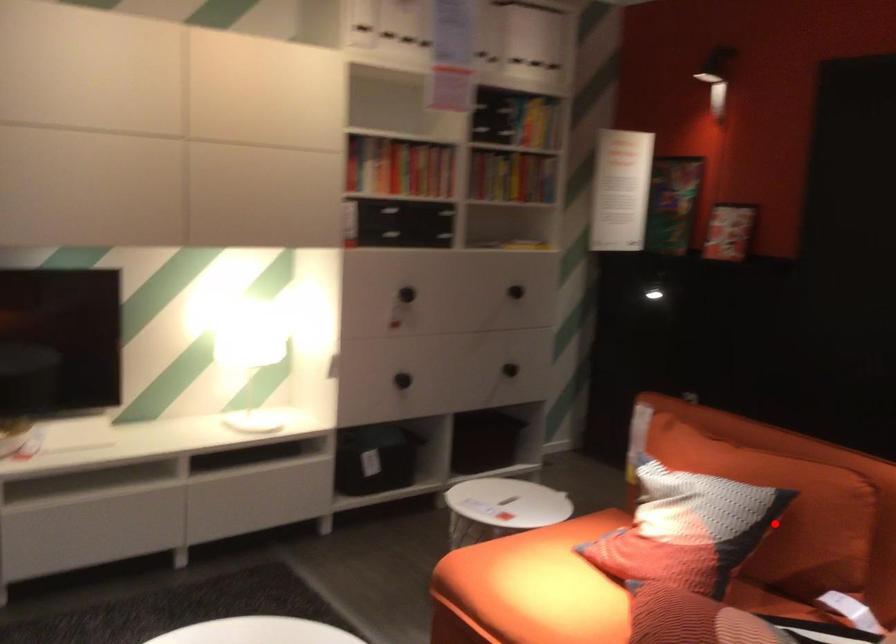
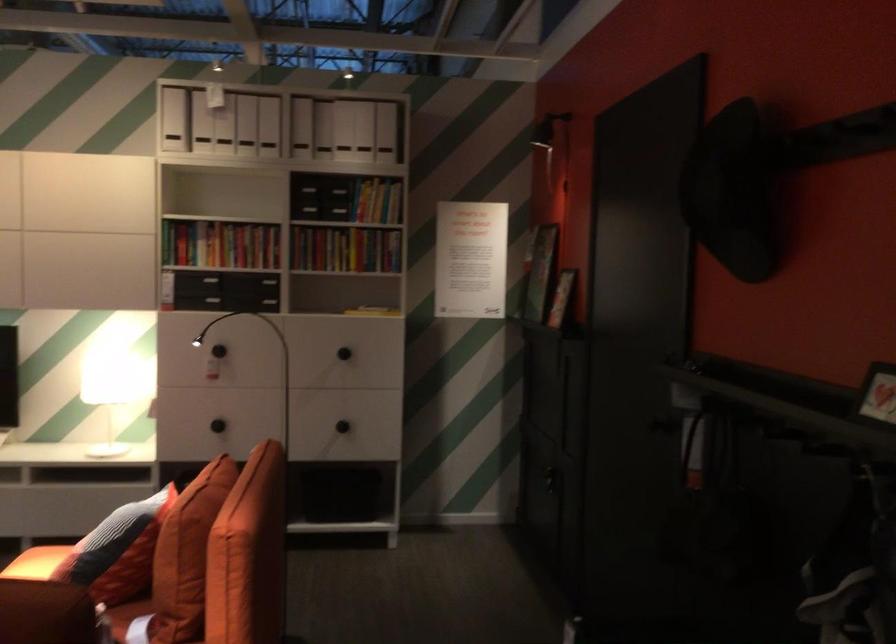
Question: I am providing you with two images of the same scene from different viewpoints. Given a red point in image1, look at the same physical point in image2. Is it:

Choices:
 (A) Closer to the viewpoint
 (B) Farther from the viewpoint

Answer: (B)